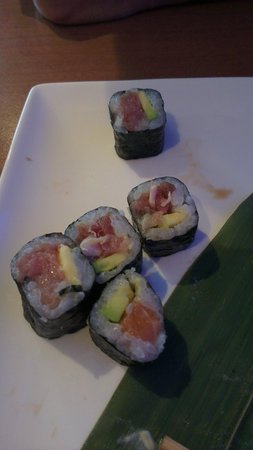
I want to click on wood table, so click(170, 48), click(53, 48).